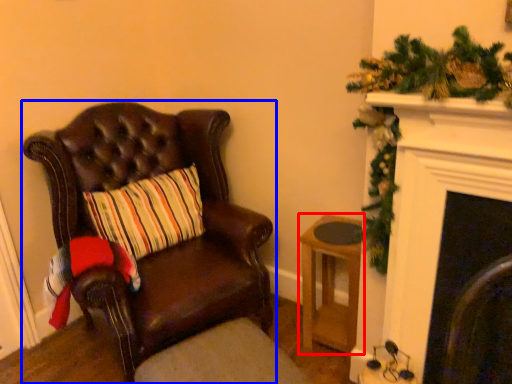
Question: Which object appears farthest to the camera in this image, stool (highlighted by a red box) or chair (highlighted by a blue box)?

Choices:
 (A) stool
 (B) chair

Answer: (A)